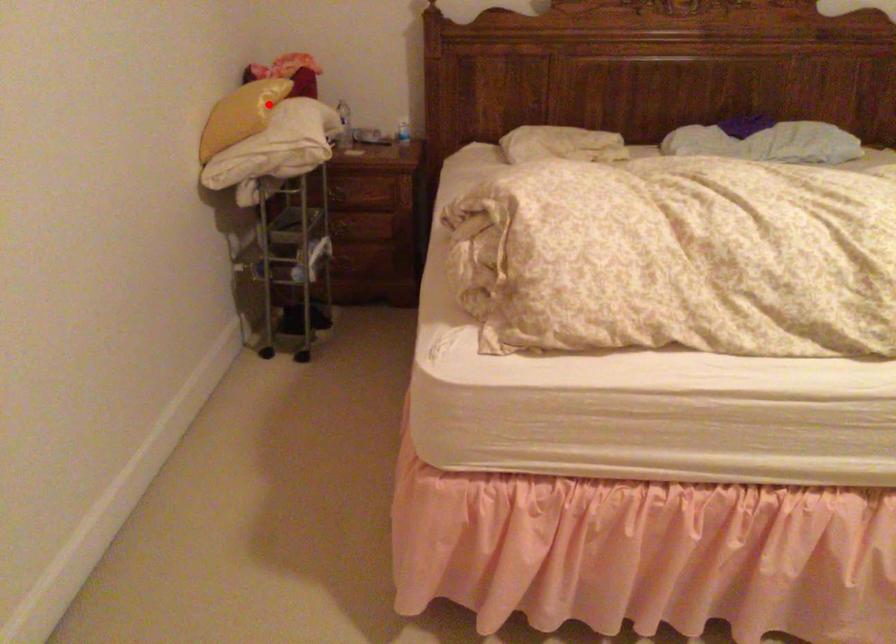
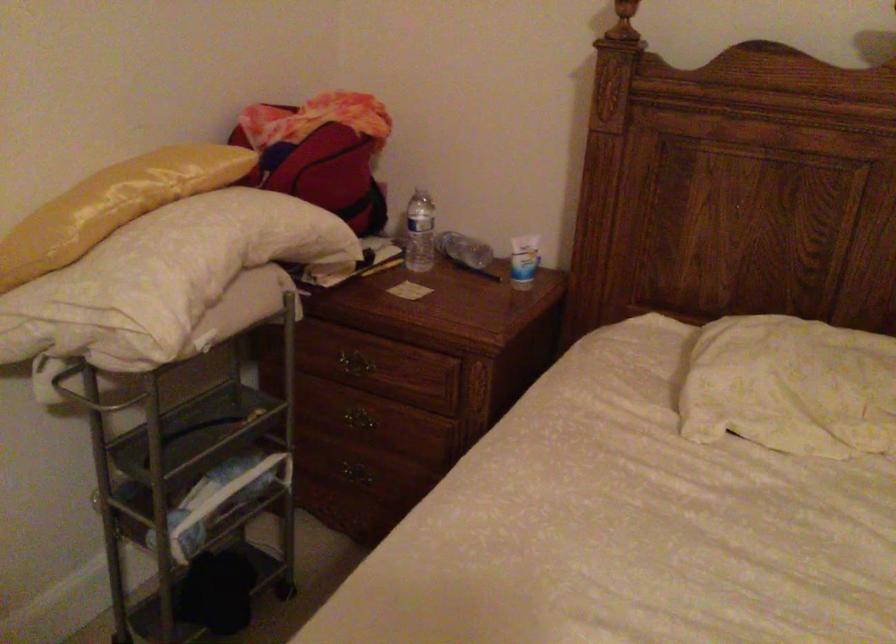
Question: A red point is marked in image1. In image2, is the corresponding 3D point closer to the camera or farther? Reply with the corresponding letter.

Choices:
 (A) The corresponding 3D point is closer.
 (B) The corresponding 3D point is farther.

Answer: (A)